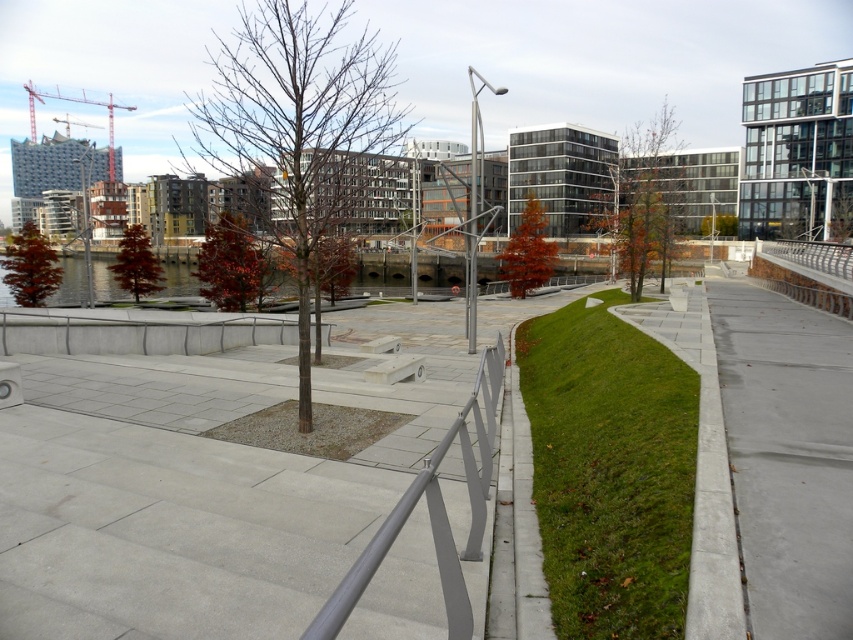
Does silver metallic rail at center appear under green leafy tree at center?

Yes.

Which is more to the left, silver metallic rail at center or green leafy tree at center?

silver metallic rail at center

Between point (471, 548) and point (717, 227), which one is positioned in front?

Positioned in front is point (471, 548).

Locate an element on the screen. The image size is (853, 640). silver metallic rail at center is located at coordinates (434, 513).

Is red glossy tree at center to the left of red matte tree at center from the viewer's perspective?

Incorrect, red glossy tree at center is not on the left side of red matte tree at center.

Measure the distance between point (216,262) and camera.

They are 114.53 feet apart.

At what (x,y) coordinates should I click in order to perform the action: click on red glossy tree at center. Please return your answer as a coordinate pair (x, y). This screenshot has width=853, height=640. Looking at the image, I should click on (230, 264).

Can you confirm if gray concrete pavement at right is wider than bare wood tree at center?

Incorrect, gray concrete pavement at right's width does not surpass bare wood tree at center's.

Between gray concrete pavement at right and bare wood tree at center, which one appears on the right side from the viewer's perspective?

gray concrete pavement at right

Where is `gray concrete pavement at right`? gray concrete pavement at right is located at coordinates (787, 458).